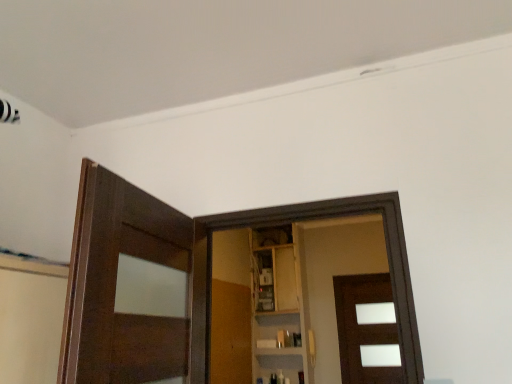
Question: Considering the relative positions of wooden at center and wooden cabinet at center in the image provided, is wooden at center to the left or to the right of wooden cabinet at center?

Choices:
 (A) right
 (B) left

Answer: (B)

Question: From a real-world perspective, is wooden at center positioned above or below wooden cabinet at center?

Choices:
 (A) above
 (B) below

Answer: (B)

Question: Estimate the real-world distances between objects in this image. Which object is closer to the wooden cabinet at center?

Choices:
 (A) brown matte door at center
 (B) wooden at center

Answer: (B)

Question: Estimate the real-world distances between objects in this image. Which object is farther from the wooden at center?

Choices:
 (A) brown matte door at center
 (B) wooden cabinet at center

Answer: (A)